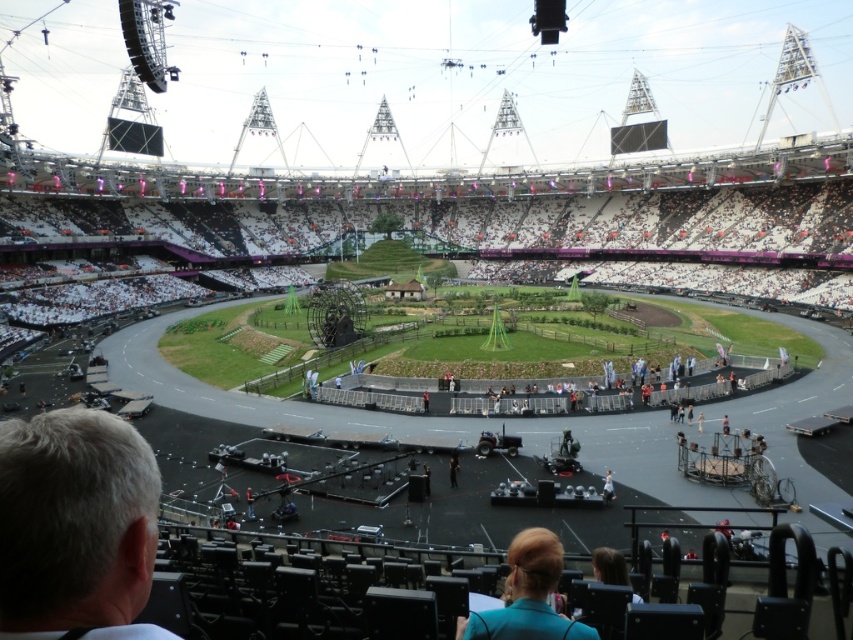
Question: Estimate the real-world distances between objects in this image. Which object is closer to the white fabric dress at center?

Choices:
 (A) teal fabric hair at lower center
 (B) dark blue suit at center

Answer: (B)

Question: Does light brown leather jacket at lower center come behind red fabric person at center?

Choices:
 (A) no
 (B) yes

Answer: (A)

Question: Which is farther from the red fabric person at center?

Choices:
 (A) dark blue fabric at center
 (B) gray hair at lower left
 (C) white fabric dress at center

Answer: (B)

Question: Is gray hair at lower left to the right of dark blue fabric at center from the viewer's perspective?

Choices:
 (A) yes
 (B) no

Answer: (B)

Question: Observing the image, what is the correct spatial positioning of dark blue suit at center in reference to orange fabric person at center?

Choices:
 (A) right
 (B) left

Answer: (B)

Question: Which of the following is the farthest from the observer?

Choices:
 (A) (608, 492)
 (B) (492, 618)

Answer: (A)